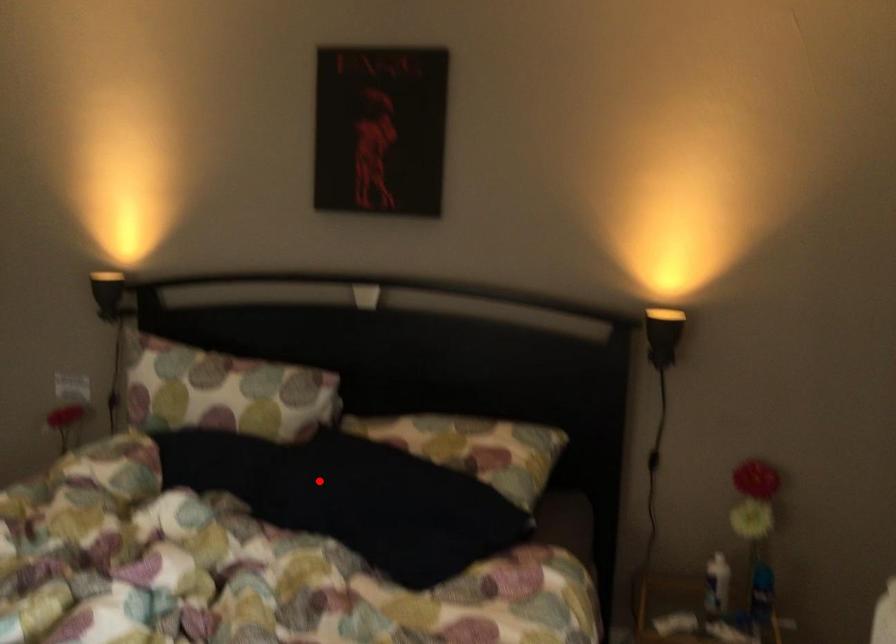
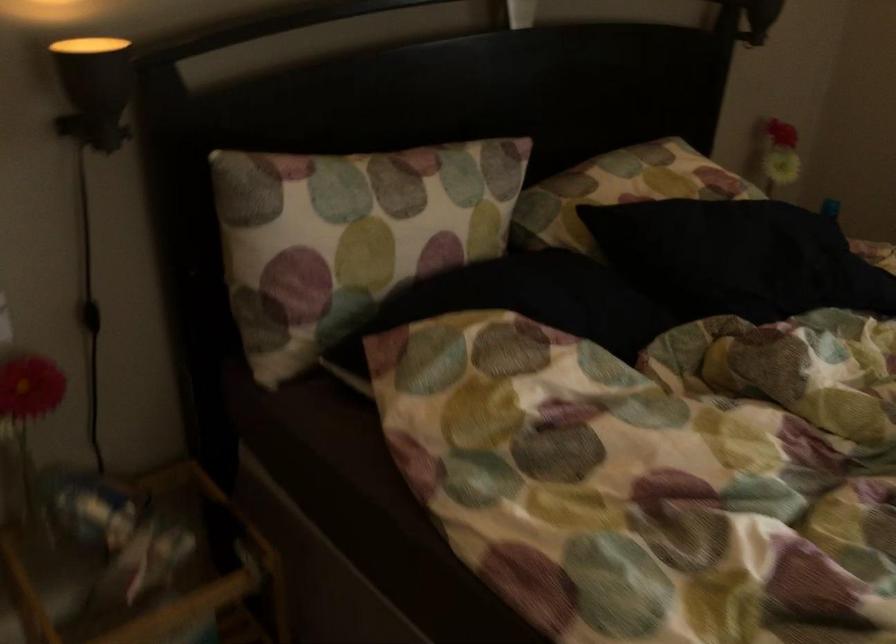
In the second image, find the point that corresponds to the highlighted location in the first image.

(737, 258)